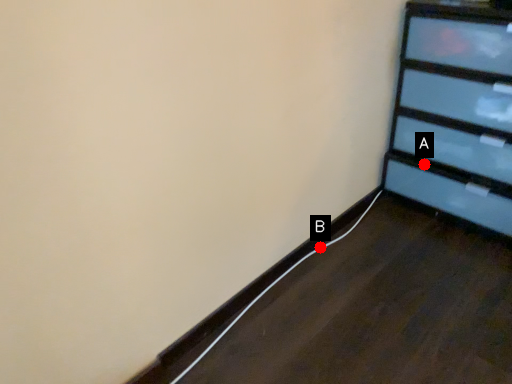
Question: Two points are circled on the image, labeled by A and B beside each circle. Which point is farther from the camera taking this photo?

Choices:
 (A) A is further
 (B) B is further

Answer: (A)